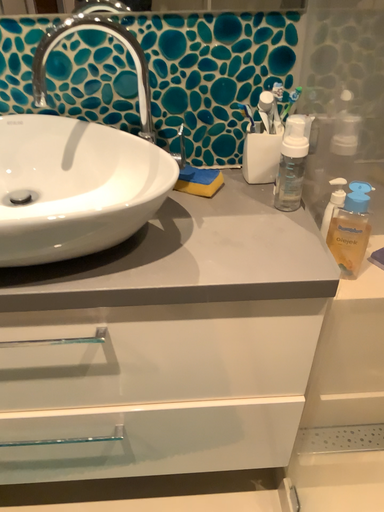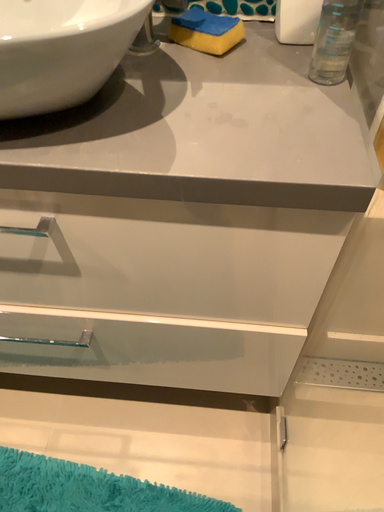
Question: How did the camera likely rotate when shooting the video?

Choices:
 (A) rotated downward
 (B) rotated upward

Answer: (A)